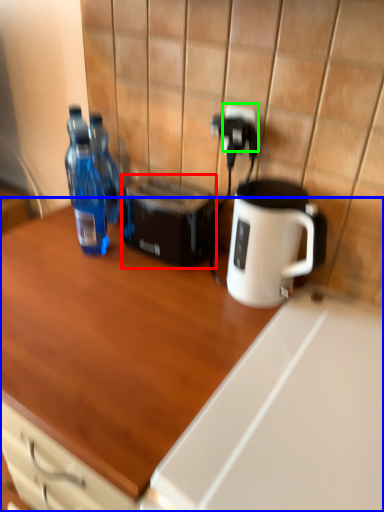
Question: Which object is the farthest from toaster (highlighted by a red box)? Choose among these: desk (highlighted by a blue box) or electric outlet (highlighted by a green box).

Choices:
 (A) desk
 (B) electric outlet

Answer: (A)